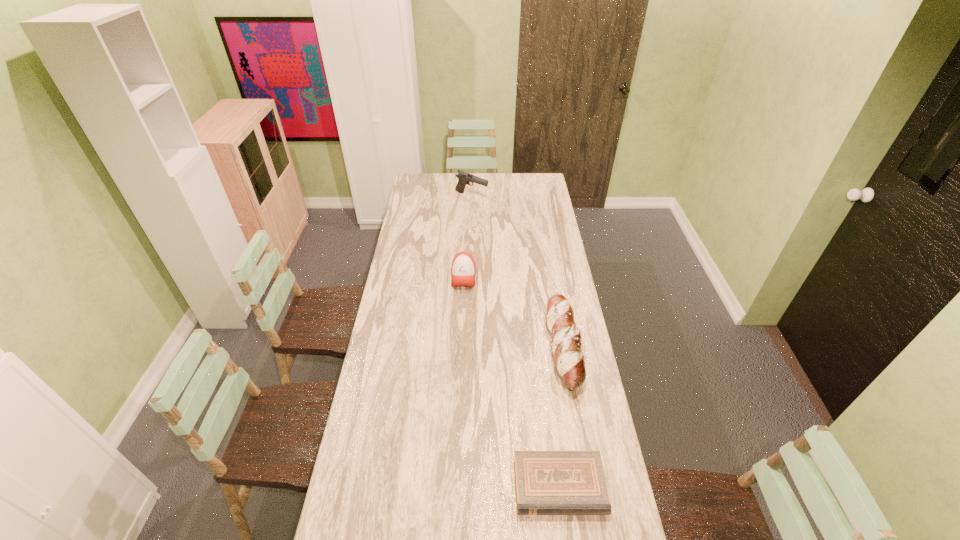
At what (x,y) coordinates should I click in order to perform the action: click on vacant space that satisfies the following two spatial constraints: 1. at the muzzle of the farthest object; 2. on the back side of the baguet. Please return your answer as a coordinate pair (x, y). Looking at the image, I should click on (468, 347).

Find the location of a particular element. This screenshot has width=960, height=540. free location that satisfies the following two spatial constraints: 1. at the muzzle of the second nearest object; 2. on the right side of the gun is located at coordinates (468, 347).

This screenshot has height=540, width=960. In order to click on vacant space that satisfies the following two spatial constraints: 1. on the front-facing side of the second nearest object; 2. on the left side of the baseball cap in this screenshot , I will do `click(461, 347)`.